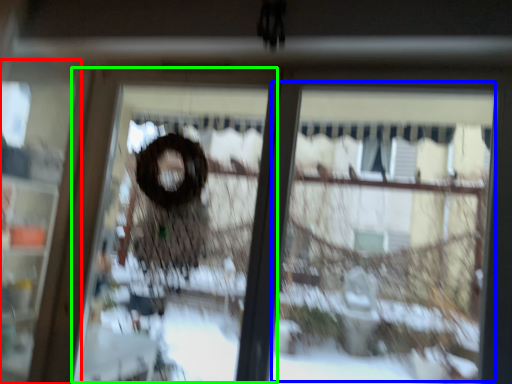
Question: Which object is the closest to the screen door (highlighted by a red box)? Choose among these: shop window (highlighted by a blue box) or screen door (highlighted by a green box).

Choices:
 (A) shop window
 (B) screen door

Answer: (B)